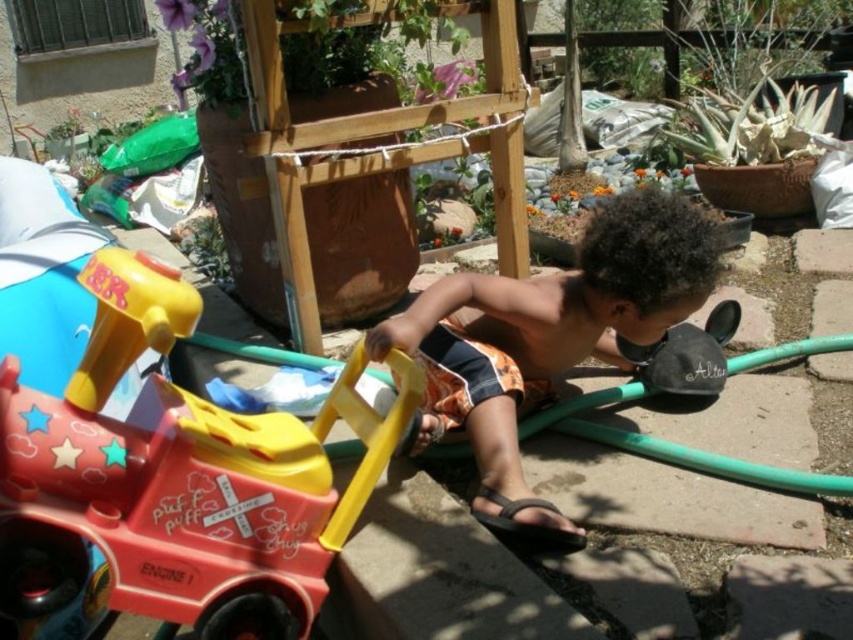
Based on the photo, you are a parent trying to locate your child who is playing in the garden. You see the matte plastic train at lower left and the brown textured shorts at center. Which object is closer to you?

The matte plastic train at lower left is closer to you because it is in front of the brown textured shorts at center.

You are a parent trying to ensure your child stays hydrated during playtime. You have a water bottle that can reach 20 inches. The child is currently playing near the matte plastic train at lower left. Can you place the water bottle so it reaches the brown textured shorts at center where the child is sitting?

The distance between the matte plastic train at lower left and the brown textured shorts at center is 19.61 inches. Since the water bottle can reach 20 inches, it will be sufficient to place the water bottle near the matte plastic train at lower left so it can reach the brown textured shorts at center.